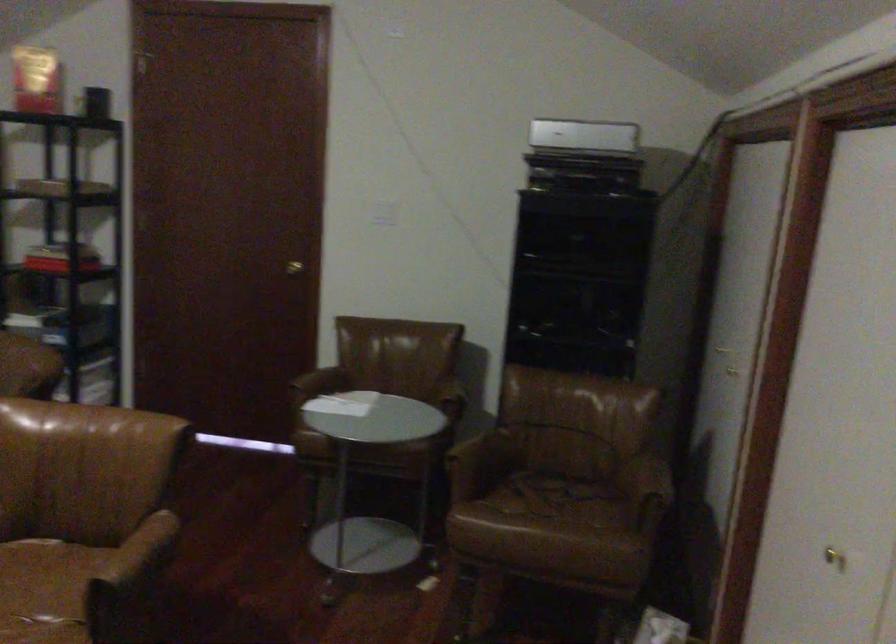
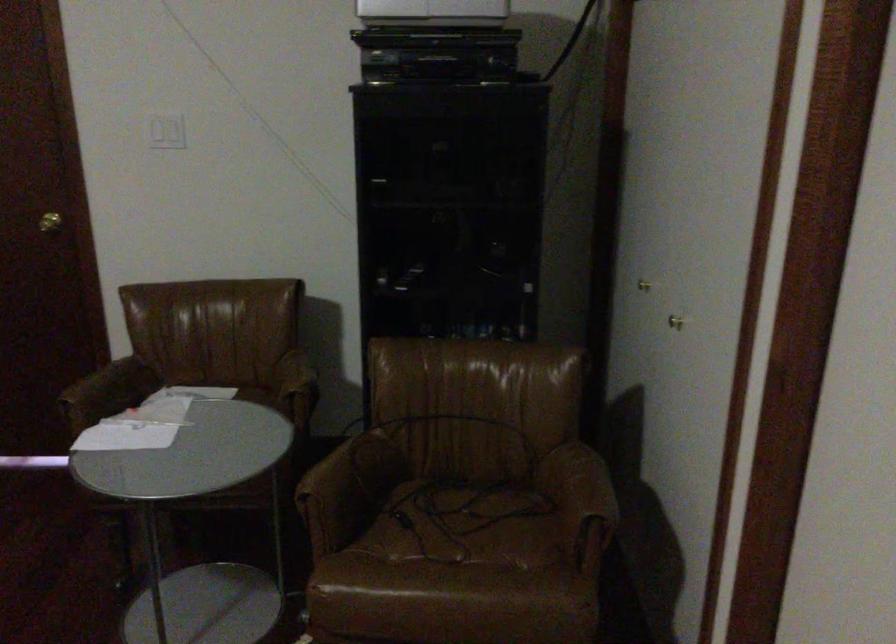
Locate, in the second image, the point that corresponds to (291,265) in the first image.

(49, 222)